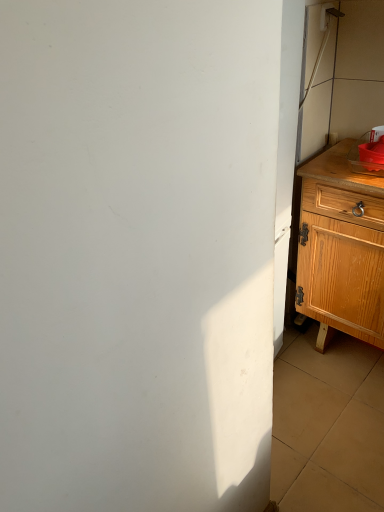
Identify the location of light brown wooden chest of drawers at right. (341, 248).

This screenshot has height=512, width=384. Describe the element at coordinates (341, 248) in the screenshot. I see `light brown wooden chest of drawers at right` at that location.

Based on the photo, in order to face matte plastic sink at right, should I rotate leftwards or rightwards?

It's best to rotate right around 24.188 degrees.

Locate an element on the screen. This screenshot has height=512, width=384. matte plastic sink at right is located at coordinates point(362,161).

The image size is (384, 512). What do you see at coordinates (362, 161) in the screenshot?
I see `matte plastic sink at right` at bounding box center [362, 161].

Find the location of a particular element. The image size is (384, 512). light brown wooden chest of drawers at right is located at coordinates (341, 248).

Which is more to the left, light brown wooden chest of drawers at right or matte plastic sink at right?

From the viewer's perspective, matte plastic sink at right appears more on the left side.

Considering the relative positions of light brown wooden chest of drawers at right and matte plastic sink at right in the image provided, is light brown wooden chest of drawers at right behind matte plastic sink at right?

No, the depth of light brown wooden chest of drawers at right is less than that of matte plastic sink at right.

Does point (352, 185) appear closer or farther from the camera than point (351, 151)?

Clearly, point (352, 185) is closer to the camera than point (351, 151).

From the image's perspective, which is below, light brown wooden chest of drawers at right or matte plastic sink at right?

light brown wooden chest of drawers at right appears lower in the image.

Based on the photo, from a real-world perspective, who is located lower, light brown wooden chest of drawers at right or matte plastic sink at right?

light brown wooden chest of drawers at right is physically lower.

Considering the relative sizes of light brown wooden chest of drawers at right and matte plastic sink at right in the image provided, is light brown wooden chest of drawers at right thinner than matte plastic sink at right?

In fact, light brown wooden chest of drawers at right might be wider than matte plastic sink at right.

Which of these two, light brown wooden chest of drawers at right or matte plastic sink at right, stands taller?

With more height is light brown wooden chest of drawers at right.

Between light brown wooden chest of drawers at right and matte plastic sink at right, which one has larger size?

light brown wooden chest of drawers at right is bigger.

Can we say light brown wooden chest of drawers at right lies outside matte plastic sink at right?

light brown wooden chest of drawers at right is positioned outside matte plastic sink at right.

Is light brown wooden chest of drawers at right touching matte plastic sink at right?

They are not placed beside each other.

Is light brown wooden chest of drawers at right aimed at matte plastic sink at right?

No.

Based on the photo, how different are the orientations of light brown wooden chest of drawers at right and matte plastic sink at right in degrees?

They differ by 8.17 degrees in their facing directions.

Locate an element on the screen. This screenshot has width=384, height=512. sink positioned vertically above the light brown wooden chest of drawers at right (from a real-world perspective) is located at coordinates (362, 161).

Considering the positions of objects matte plastic sink at right and light brown wooden chest of drawers at right in the image provided, who is more to the left, matte plastic sink at right or light brown wooden chest of drawers at right?

matte plastic sink at right.

Is matte plastic sink at right further to camera compared to light brown wooden chest of drawers at right?

Yes.

Which point is more forward, [354,165] or [342,167]?

Positioned in front is point [354,165].

From the picture: From the image's perspective, is matte plastic sink at right located above or below light brown wooden chest of drawers at right?

Clearly, from the image's perspective, matte plastic sink at right is above light brown wooden chest of drawers at right.

From a real-world perspective, is matte plastic sink at right physically located above or below light brown wooden chest of drawers at right?

matte plastic sink at right is above light brown wooden chest of drawers at right.

Which of these two, matte plastic sink at right or light brown wooden chest of drawers at right, is wider?

Wider between the two is light brown wooden chest of drawers at right.

Which of these two, matte plastic sink at right or light brown wooden chest of drawers at right, stands shorter?

matte plastic sink at right is shorter.

Can you confirm if matte plastic sink at right is smaller than light brown wooden chest of drawers at right?

Yes.

Is matte plastic sink at right situated inside light brown wooden chest of drawers at right or outside?

matte plastic sink at right is not enclosed by light brown wooden chest of drawers at right.

In the scene shown: Is matte plastic sink at right far from light brown wooden chest of drawers at right?

They are positioned close to each other.

From the picture: Is matte plastic sink at right facing towards light brown wooden chest of drawers at right?

No, matte plastic sink at right is not facing towards light brown wooden chest of drawers at right.

I want to click on the chest of drawers that appears below the matte plastic sink at right (from a real-world perspective), so click(x=341, y=248).

This screenshot has height=512, width=384. Identify the location of chest of drawers below the matte plastic sink at right (from the image's perspective). (341, 248).

The width and height of the screenshot is (384, 512). Identify the location of chest of drawers on the right of matte plastic sink at right. (341, 248).